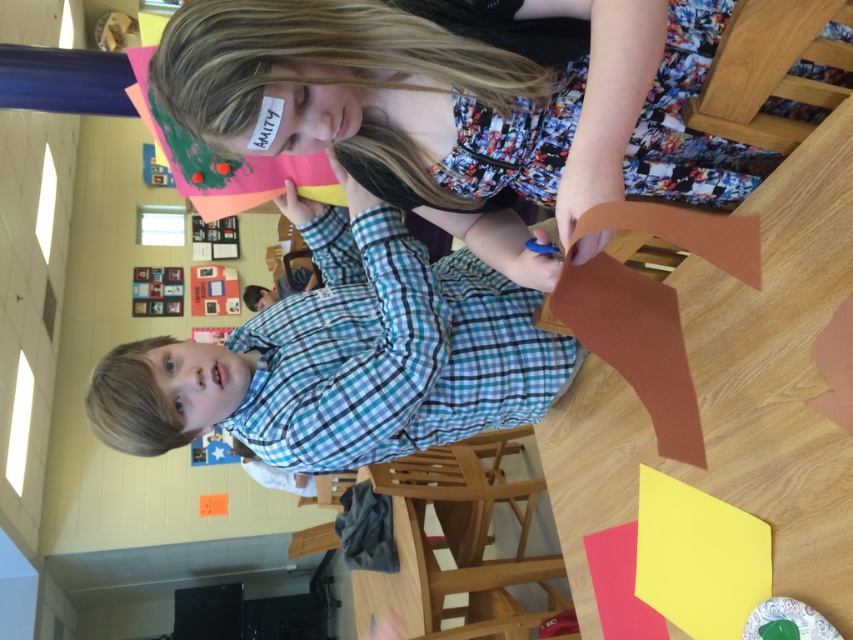
Who is more distant from viewer, [630,44] or [422,376]?

Point [422,376]

From the picture: Can you confirm if matte paper at upper center is positioned to the right of matte plaid shirt at center?

Correct, you'll find matte paper at upper center to the right of matte plaid shirt at center.

Is point (646, 173) positioned after point (389, 228)?

No, (646, 173) is in front of (389, 228).

Where is `matte paper at upper center`? Image resolution: width=853 pixels, height=640 pixels. matte paper at upper center is located at coordinates (451, 106).